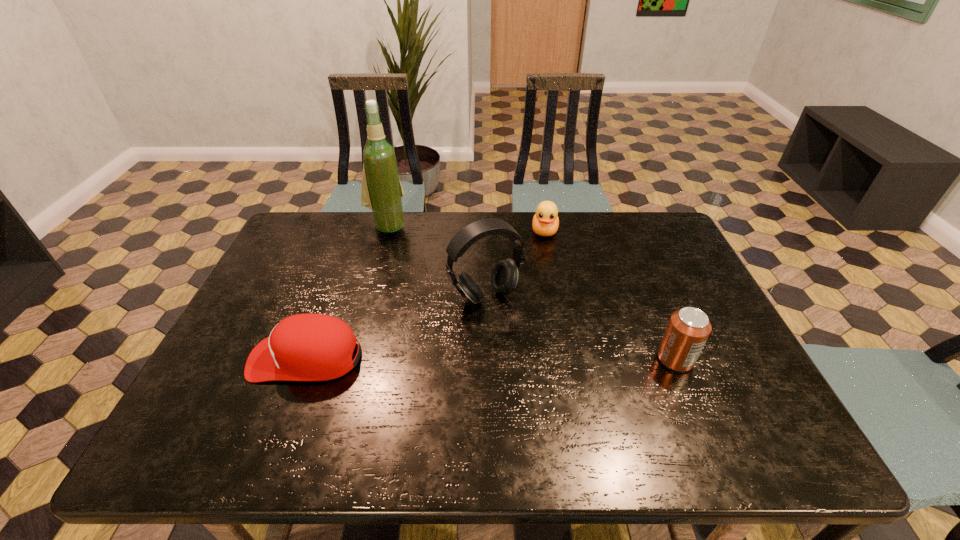
Identify the location of vacant space on the desktop that is between the baseball cap and the third shortest object and is positioned on the front-facing side of the wine bottle. (449, 358).

At what (x,y) coordinates should I click in order to perform the action: click on vacant spot on the desktop that is between the baseball cap and the rightmost object and is positioned on the ear cups of the earphone. Please return your answer as a coordinate pair (x, y). Looking at the image, I should click on (529, 359).

Find the location of a particular element. This screenshot has width=960, height=540. free spot on the desktop that is between the baseball cap and the third shortest object and is positioned on the face of the second object from right to left is located at coordinates (532, 359).